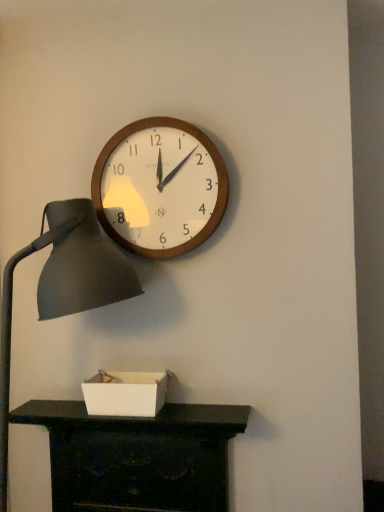
Question: Visually, is matte black desk at lower center positioned to the left or to the right of wooden wall clock at upper center?

Choices:
 (A) left
 (B) right

Answer: (A)

Question: Is point (99, 455) closer or farther from the camera than point (135, 222)?

Choices:
 (A) farther
 (B) closer

Answer: (A)

Question: Which of these objects is positioned closest to the wooden wall clock at upper center?

Choices:
 (A) matte black desk at lower center
 (B) white cardboard box at lower center
 (C) matte black lamp at left

Answer: (C)

Question: Based on their relative distances, which object is nearer to the white cardboard box at lower center?

Choices:
 (A) matte black desk at lower center
 (B) matte black lamp at left
 (C) wooden wall clock at upper center

Answer: (A)